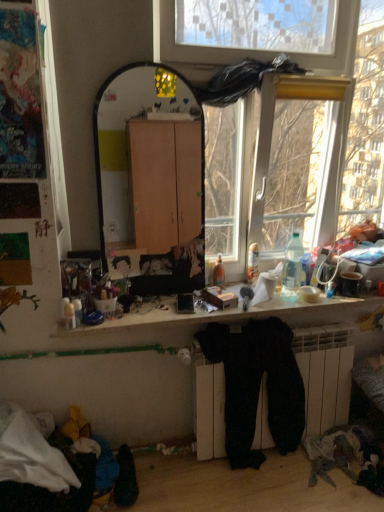
Question: Should I look upward or downward to see silky black fabric at center, which is the first person in right-to-left order?

Choices:
 (A) up
 (B) down

Answer: (B)

Question: From the image's perspective, does silky black fabric at center, which is the first person in right-to-left order, appear lower than wooden desk at center?

Choices:
 (A) no
 (B) yes

Answer: (A)

Question: From a real-world perspective, is silky black fabric at center, which is the first person in right-to-left order, under wooden desk at center?

Choices:
 (A) yes
 (B) no

Answer: (B)

Question: Considering the relative sizes of silky black fabric at center, the 2th person in the left-to-right sequence, and wooden desk at center in the image provided, is silky black fabric at center, the 2th person in the left-to-right sequence, shorter than wooden desk at center?

Choices:
 (A) yes
 (B) no

Answer: (B)

Question: Is silky black fabric at center, the 2th person in the left-to-right sequence, oriented away from wooden desk at center?

Choices:
 (A) yes
 (B) no

Answer: (B)

Question: Considering the relative sizes of silky black fabric at center, which is the first person in right-to-left order, and wooden desk at center in the image provided, is silky black fabric at center, which is the first person in right-to-left order, thinner than wooden desk at center?

Choices:
 (A) yes
 (B) no

Answer: (A)

Question: Could wooden desk at center be considered to be inside silky black fabric at center, which is the first person in right-to-left order?

Choices:
 (A) no
 (B) yes

Answer: (A)

Question: Considering the relative sizes of wooden desk at center and silky black fabric at center, which is the first person in right-to-left order, in the image provided, is wooden desk at center smaller than silky black fabric at center, which is the first person in right-to-left order,?

Choices:
 (A) yes
 (B) no

Answer: (B)

Question: From the image's perspective, does wooden desk at center appear higher than silky black fabric at center, which is the first person in right-to-left order?

Choices:
 (A) no
 (B) yes

Answer: (A)

Question: Is the surface of wooden desk at center in direct contact with silky black fabric at center, which is the first person in right-to-left order?

Choices:
 (A) yes
 (B) no

Answer: (B)

Question: From a real-world perspective, is wooden desk at center positioned over silky black fabric at center, the 2th person in the left-to-right sequence, based on gravity?

Choices:
 (A) no
 (B) yes

Answer: (A)

Question: Would you consider wooden desk at center to be distant from silky black fabric at center, which is the first person in right-to-left order?

Choices:
 (A) no
 (B) yes

Answer: (A)

Question: Does wooden desk at center have a larger size compared to silky black fabric at center, the 2th person in the left-to-right sequence?

Choices:
 (A) no
 (B) yes

Answer: (B)

Question: Is silky black fabric at center, which is the first person in right-to-left order, located within clear plastic bottle at right?

Choices:
 (A) yes
 (B) no

Answer: (B)